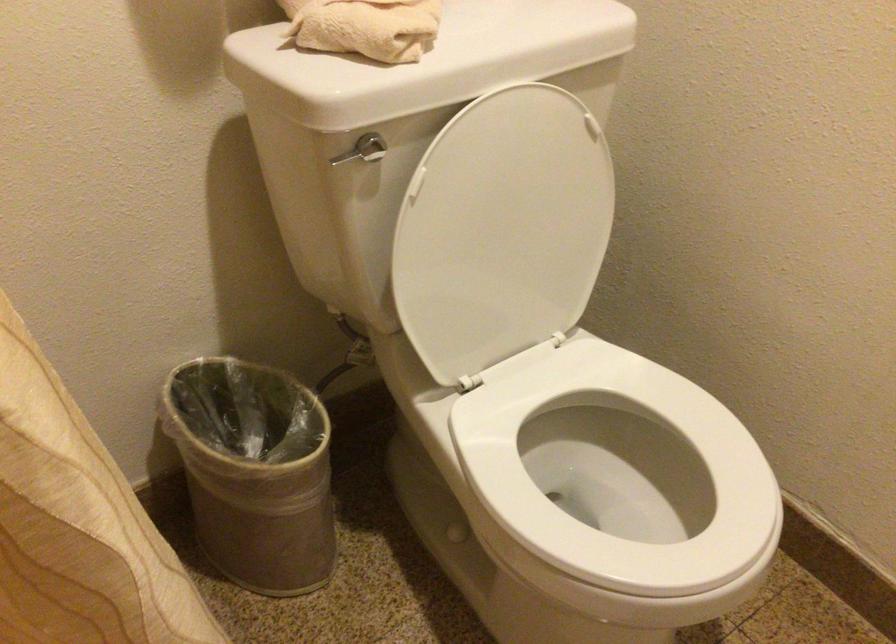
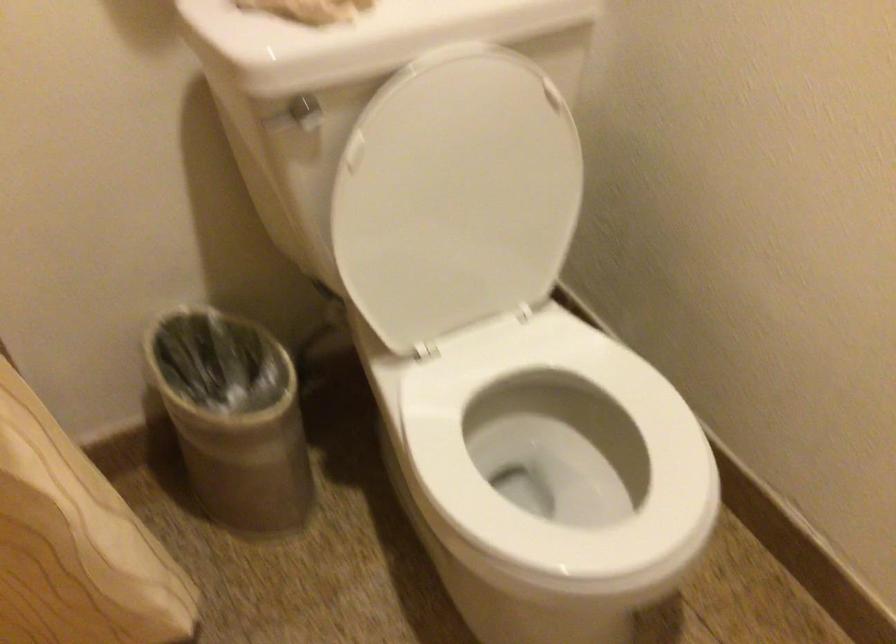
Question: The images are taken continuously from a first-person perspective. In which direction are you moving?

Choices:
 (A) Left
 (B) Right
 (C) Forward
 (D) Backward

Answer: (B)